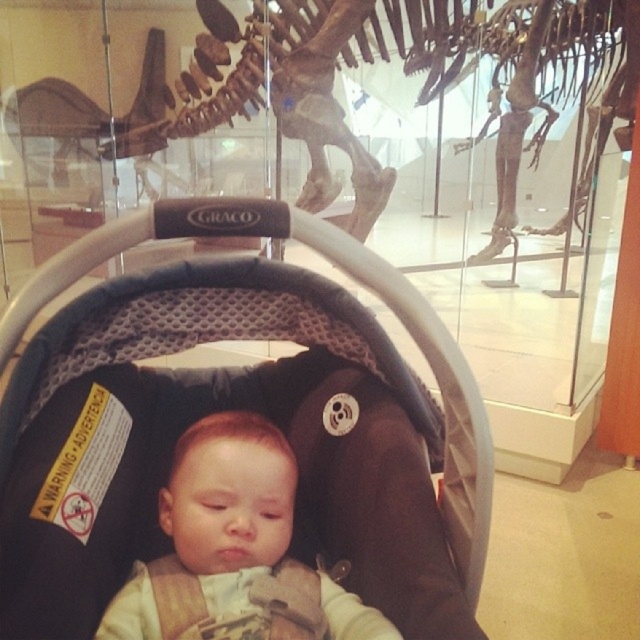
Question: From the image, what is the correct spatial relationship of black mesh car seat at center in relation to bone-like skeleton at center?

Choices:
 (A) right
 (B) left

Answer: (A)

Question: Can you confirm if black mesh car seat at center is positioned below bone-like skeleton at center?

Choices:
 (A) no
 (B) yes

Answer: (B)

Question: Which object is farther from the camera taking this photo?

Choices:
 (A) black mesh car seat at center
 (B) bone-like skeleton at center
 (C) smooth beige baby at center

Answer: (B)

Question: Is black mesh car seat at center bigger than smooth beige baby at center?

Choices:
 (A) yes
 (B) no

Answer: (A)

Question: Which of the following is the closest to the observer?

Choices:
 (A) (259, 508)
 (B) (45, 291)

Answer: (B)

Question: Which object is the closest to the smooth beige baby at center?

Choices:
 (A) bone-like skeleton at center
 (B) black mesh car seat at center

Answer: (B)